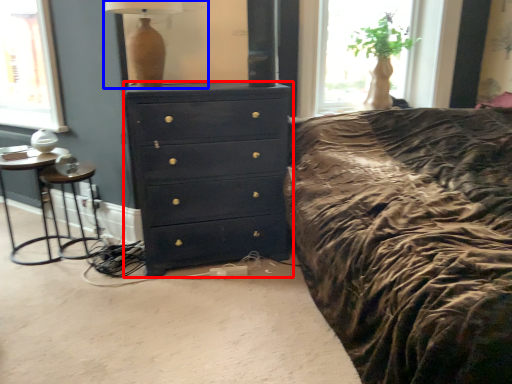
Question: Which object appears farthest to the camera in this image, chest of drawers (highlighted by a red box) or table lamp (highlighted by a blue box)?

Choices:
 (A) chest of drawers
 (B) table lamp

Answer: (A)